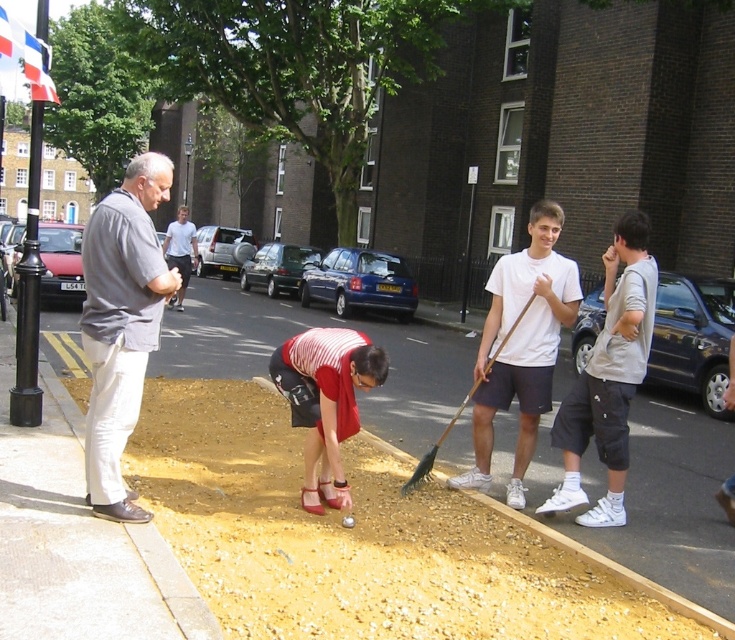
Question: Is brown gravel at lower center smaller than gray cotton shirt at left?

Choices:
 (A) yes
 (B) no

Answer: (B)

Question: Which of the following is the farthest from the observer?

Choices:
 (A) (111, 458)
 (B) (606, 348)

Answer: (B)

Question: Among these points, which one is farthest from the camera?

Choices:
 (A) (498, 349)
 (B) (492, 296)
 (C) (190, 236)

Answer: (C)

Question: Which of the following is the farthest from the observer?

Choices:
 (A) (420, 460)
 (B) (692, 554)

Answer: (A)

Question: Observing the image, what is the correct spatial positioning of gray cotton shirt at left in reference to striped fabric shirt at center?

Choices:
 (A) right
 (B) left

Answer: (B)

Question: Can you confirm if gray cotton shirt at left is smaller than white matte t-shirt at center?

Choices:
 (A) no
 (B) yes

Answer: (A)